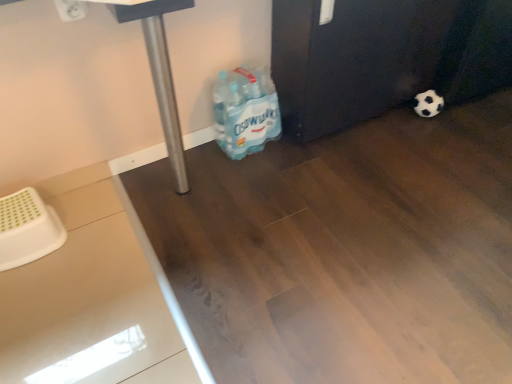
Question: From a real-world perspective, does blue plastic water bottles at lower center stand above black and white textured football at lower right?

Choices:
 (A) no
 (B) yes

Answer: (B)

Question: Does blue plastic water bottles at lower center have a lesser height compared to black and white textured football at lower right?

Choices:
 (A) no
 (B) yes

Answer: (A)

Question: Can you confirm if blue plastic water bottles at lower center is smaller than black and white textured football at lower right?

Choices:
 (A) yes
 (B) no

Answer: (B)

Question: Is blue plastic water bottles at lower center outside black and white textured football at lower right?

Choices:
 (A) yes
 (B) no

Answer: (A)

Question: Is blue plastic water bottles at lower center wider than black and white textured football at lower right?

Choices:
 (A) no
 (B) yes

Answer: (B)

Question: Does blue plastic water bottles at lower center have a lesser width compared to black and white textured football at lower right?

Choices:
 (A) no
 (B) yes

Answer: (A)

Question: Is black and white textured football at lower right positioned behind blue plastic water bottles at lower center?

Choices:
 (A) no
 (B) yes

Answer: (B)

Question: Does black and white textured football at lower right contain blue plastic water bottles at lower center?

Choices:
 (A) yes
 (B) no

Answer: (B)

Question: From the image's perspective, would you say black and white textured football at lower right is shown under blue plastic water bottles at lower center?

Choices:
 (A) no
 (B) yes

Answer: (A)

Question: Would you consider black and white textured football at lower right to be distant from blue plastic water bottles at lower center?

Choices:
 (A) yes
 (B) no

Answer: (B)

Question: Does black and white textured football at lower right have a smaller size compared to blue plastic water bottles at lower center?

Choices:
 (A) yes
 (B) no

Answer: (A)

Question: Does black and white textured football at lower right appear on the left side of blue plastic water bottles at lower center?

Choices:
 (A) yes
 (B) no

Answer: (B)

Question: Relative to blue plastic water bottles at lower center, is black and white textured football at lower right in front or behind?

Choices:
 (A) front
 (B) behind

Answer: (B)